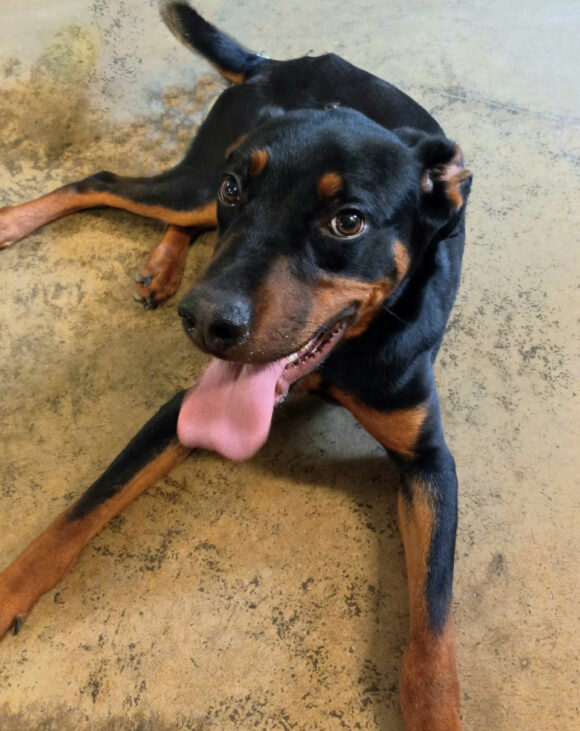
Image resolution: width=580 pixels, height=731 pixels. In order to click on floor in this screenshot , I will do pyautogui.click(x=463, y=424).